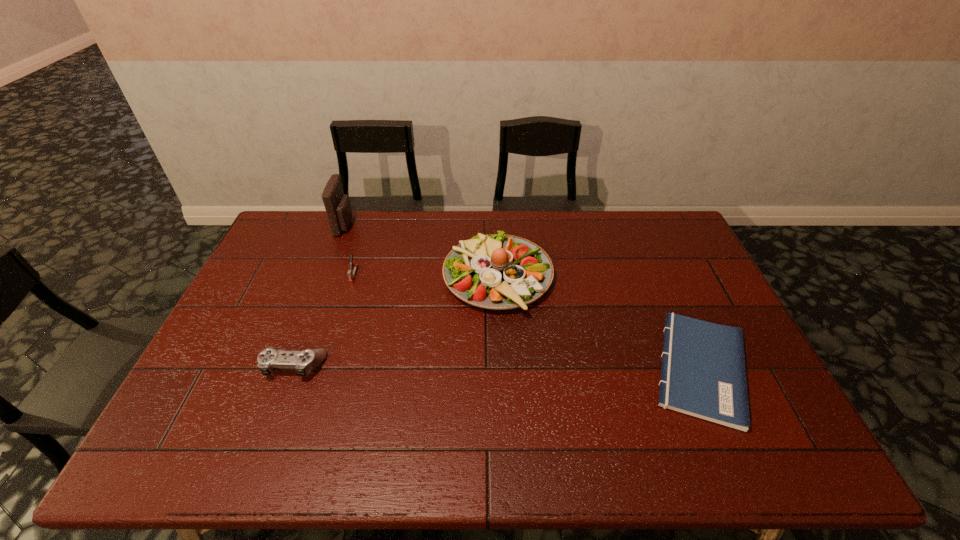
You are a GUI agent. You are given a task and a screenshot of the screen. Output one action in this format:
    pyautogui.click(x=<x>, y=<y>)
    Task: Click on the vacant region between the salad plate and the third shortest object
    
    Given the screenshot: What is the action you would take?
    pyautogui.click(x=426, y=276)

Identify the location of vacant space in between the shortest object and the stapler. The height and width of the screenshot is (540, 960). (527, 321).

Locate an element on the screen. This screenshot has height=540, width=960. empty space that is in between the pouch and the fourth shortest object is located at coordinates (421, 251).

Locate an element on the screen. vacant point located between the rightmost object and the stapler is located at coordinates (527, 321).

The width and height of the screenshot is (960, 540). Identify the location of object that can be found as the second closest to the stapler. (304, 361).

This screenshot has height=540, width=960. Identify the location of the third closest object relative to the pouch. (304, 361).

This screenshot has height=540, width=960. In order to click on free point that satisfies the following two spatial constraints: 1. on the front side of the fourth shortest object; 2. on the left side of the shortest object in this screenshot , I will do point(502,368).

The width and height of the screenshot is (960, 540). What are the coordinates of `free region that satisfies the following two spatial constraints: 1. on the handle side of the stapler; 2. on the right side of the fourth object from left to right` in the screenshot? It's located at (353, 277).

Locate an element on the screen. The image size is (960, 540). vacant space that satisfies the following two spatial constraints: 1. on the handle side of the rightmost object; 2. on the right side of the third shortest object is located at coordinates (324, 368).

Identify the location of vacant space that satisfies the following two spatial constraints: 1. on the handle side of the third shortest object; 2. on the left side of the shortest object. The width and height of the screenshot is (960, 540). (324, 368).